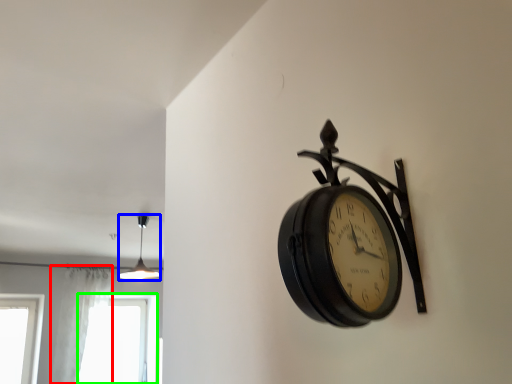
Question: Considering the real-world distances, which object is closest to curtain (highlighted by a red box)? lamp (highlighted by a blue box) or window (highlighted by a green box).

Choices:
 (A) lamp
 (B) window

Answer: (B)